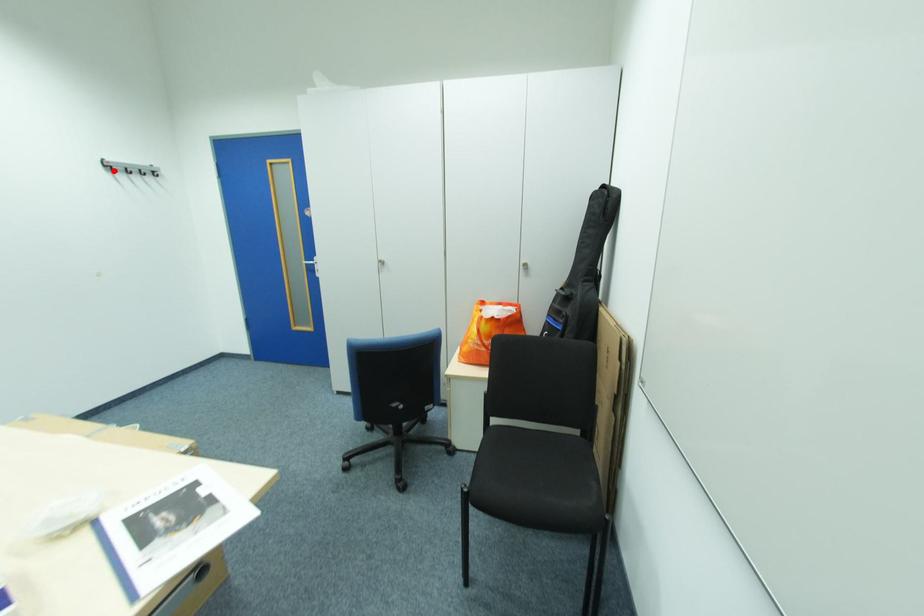
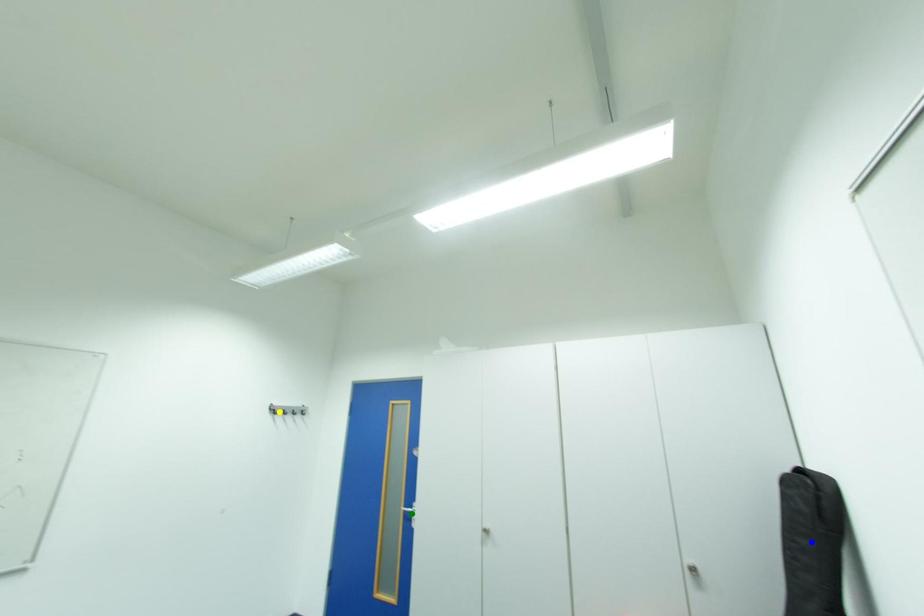
Question: I am providing you with two images of the same scene from different viewpoints. A red point is marked on the first image. You are given multiple points on the second image. In image 2, which mark is for the same physical point as the one in image 1?

Choices:
 (A) yellow point
 (B) blue point
 (C) green point

Answer: (A)